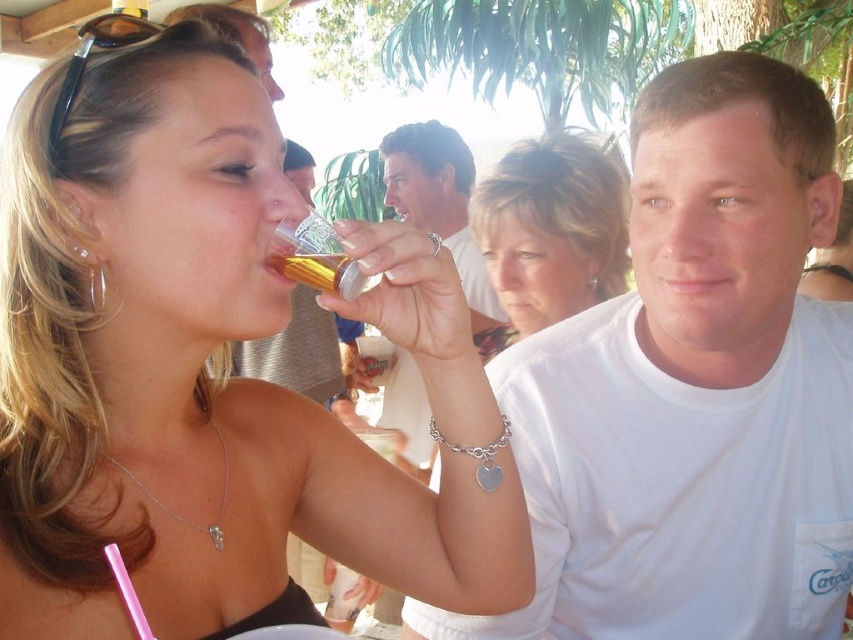
Does smooth silver ring at center appear on the right side of gold metallic can at upper center?

Correct, you'll find smooth silver ring at center to the right of gold metallic can at upper center.

Is smooth silver ring at center bigger than gold metallic can at upper center?

Correct, smooth silver ring at center is larger in size than gold metallic can at upper center.

What do you see at coordinates (439, 202) in the screenshot? I see `smooth silver ring at center` at bounding box center [439, 202].

At what (x,y) coordinates should I click in order to perform the action: click on smooth silver ring at center. Please return your answer as a coordinate pair (x, y). Image resolution: width=853 pixels, height=640 pixels. Looking at the image, I should click on (439, 202).

Can you confirm if matte black glass at upper left is smaller than white matte t-shirt at center?

Yes, matte black glass at upper left is smaller than white matte t-shirt at center.

Is point (45, 465) farther from viewer compared to point (233, 35)?

No, (45, 465) is closer to viewer.

Is point (166, 394) positioned behind point (315, 342)?

No.

Locate an element on the screen. Image resolution: width=853 pixels, height=640 pixels. matte black glass at upper left is located at coordinates (207, 371).

Does point (83, 115) come farther from viewer compared to point (776, 220)?

No, (83, 115) is closer to viewer.

Does point (395, 531) come closer to viewer compared to point (788, 282)?

Yes, it is.

Where is `matte black glass at upper left`? This screenshot has width=853, height=640. matte black glass at upper left is located at coordinates (207, 371).

Where is `matte black glass at upper left`? matte black glass at upper left is located at coordinates (207, 371).